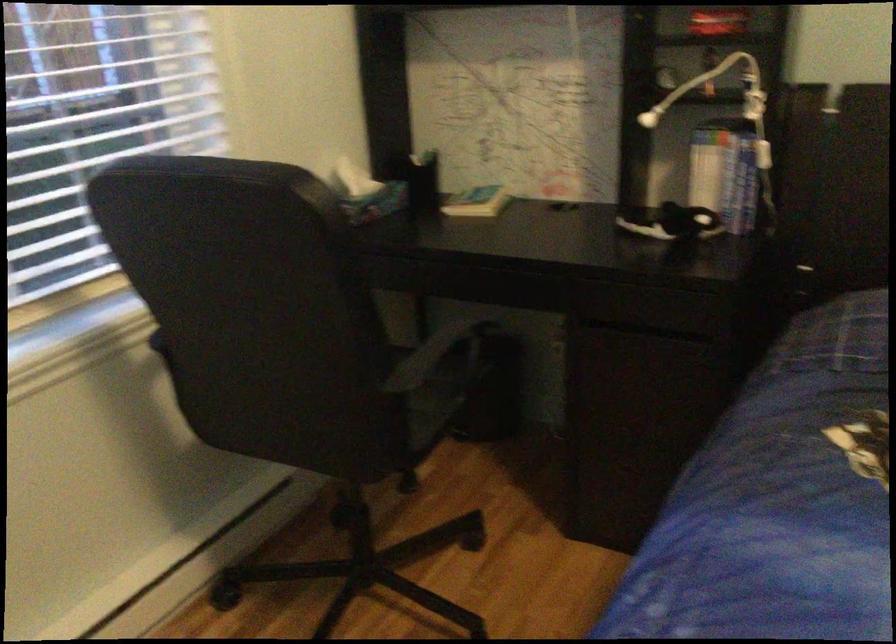
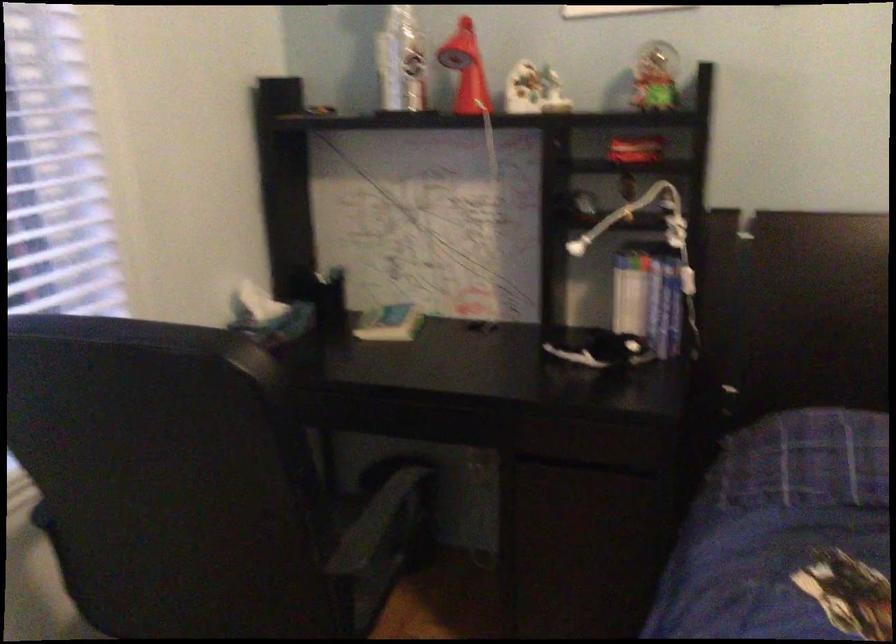
The point at (704, 176) is marked in the first image. Where is the corresponding point in the second image?

(629, 301)